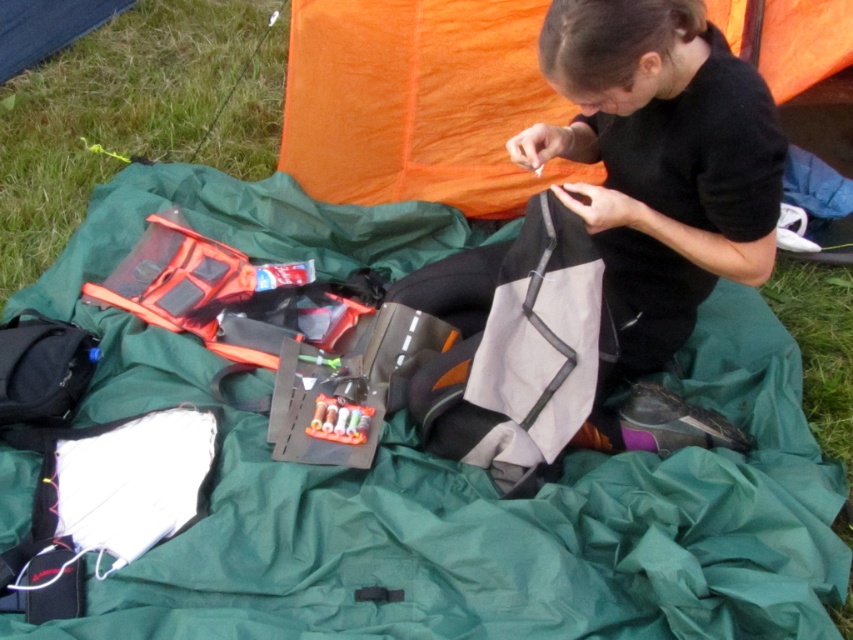
Question: Considering the relative positions of green fabric blanket at center and black matte fabric bag at center in the image provided, where is green fabric blanket at center located with respect to black matte fabric bag at center?

Choices:
 (A) right
 (B) left

Answer: (B)

Question: Which object appears farthest from the camera in this image?

Choices:
 (A) green fabric blanket at center
 (B) black matte fabric bag at center

Answer: (A)

Question: In this image, where is green fabric blanket at center located relative to black matte fabric bag at center?

Choices:
 (A) right
 (B) left

Answer: (B)

Question: Which point is closer to the camera taking this photo?

Choices:
 (A) (96, 401)
 (B) (693, 209)

Answer: (B)

Question: Does green fabric blanket at center lie in front of black matte fabric bag at center?

Choices:
 (A) yes
 (B) no

Answer: (B)